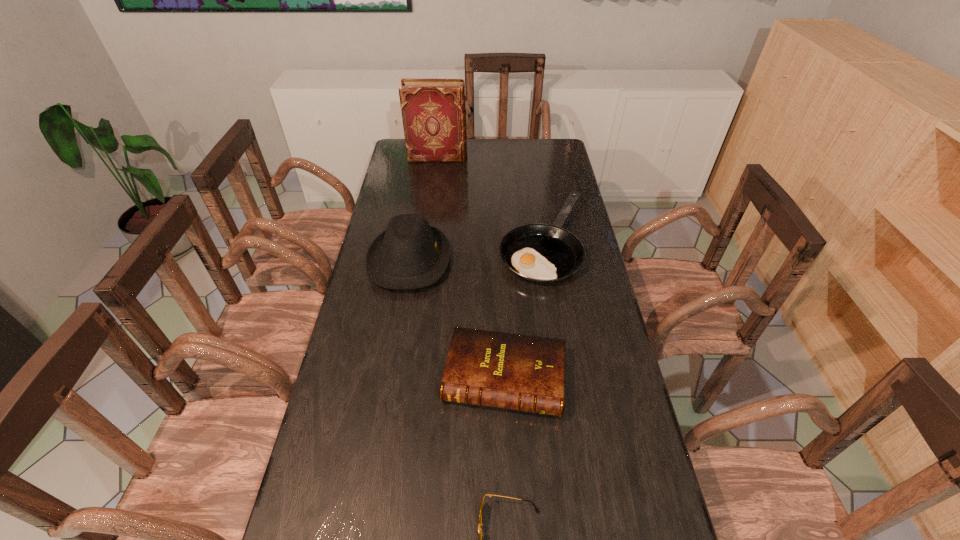
Where is `free location that satisfies the following two spatial constraints: 1. on the front-facing side of the fedora; 2. on the back side of the fourth farthest object`? The width and height of the screenshot is (960, 540). free location that satisfies the following two spatial constraints: 1. on the front-facing side of the fedora; 2. on the back side of the fourth farthest object is located at coordinates (390, 378).